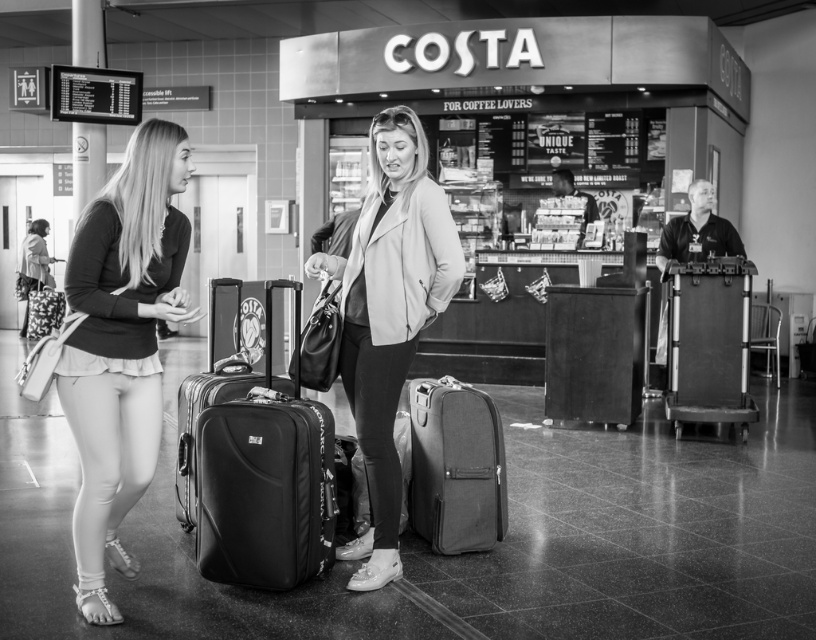
Question: Which of the following is the farthest from the observer?

Choices:
 (A) (440, 195)
 (B) (693, 305)
 (C) (135, 259)
 (D) (233, 534)

Answer: (B)

Question: Can you confirm if matte black top at left is smaller than canvas suitcase at center?

Choices:
 (A) no
 (B) yes

Answer: (A)

Question: Does leather jacket at center come in front of metallic suitcase at right?

Choices:
 (A) no
 (B) yes

Answer: (B)

Question: Is the position of matte black top at left less distant than that of metallic suitcase at right?

Choices:
 (A) no
 (B) yes

Answer: (B)

Question: Which point appears farthest from the camera in this image?

Choices:
 (A) (296, 580)
 (B) (488, 477)
 (C) (153, 141)
 (D) (455, 266)

Answer: (B)

Question: Which object appears farthest from the camera in this image?

Choices:
 (A) canvas suitcase at center
 (B) matte black suitcase at center
 (C) leather jacket at center
 (D) matte black top at left

Answer: (A)